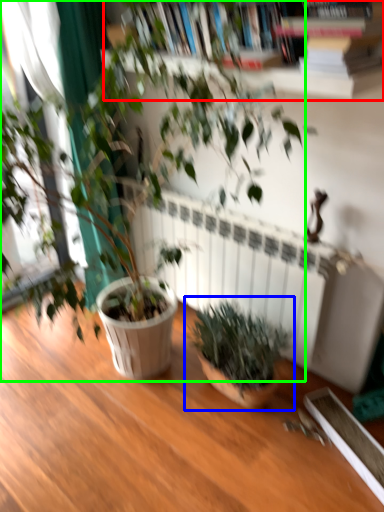
Question: Considering the real-world distances, which object is farthest from bookcase (highlighted by a red box)? houseplant (highlighted by a blue box) or houseplant (highlighted by a green box)?

Choices:
 (A) houseplant
 (B) houseplant

Answer: (A)